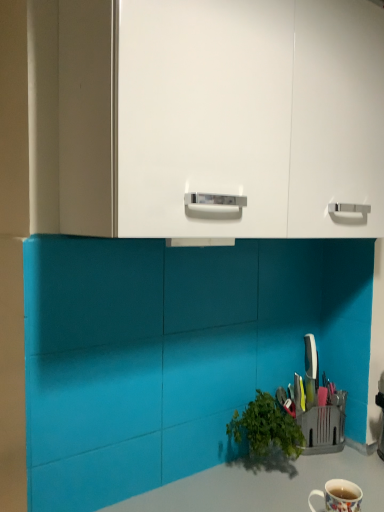
Find the location of `white glossy mug at lower right`. white glossy mug at lower right is located at coordinates tap(339, 496).

Identify the location of white glossy cabinet at upper center. (220, 114).

I want to click on white glossy mug at lower right, so click(339, 496).

Which is closer, [312,29] or [358,479]?

The point [312,29] is closer to the camera.

Looking at their sizes, would you say white glossy cabinet at upper center is wider or thinner than smooth gray countertop at lower center?

Considering their sizes, white glossy cabinet at upper center looks slimmer than smooth gray countertop at lower center.

How many degrees apart are the facing directions of white glossy cabinet at upper center and smooth gray countertop at lower center?

The facing directions of white glossy cabinet at upper center and smooth gray countertop at lower center are 1.27 degrees apart.

From the image's perspective, is white glossy cabinet at upper center positioned above or below smooth gray countertop at lower center?

Clearly, from the image's perspective, white glossy cabinet at upper center is above smooth gray countertop at lower center.

Between point (376, 468) and point (331, 499), which one is positioned in front?

Positioned in front is point (331, 499).

From a real-world perspective, between smooth gray countertop at lower center and white glossy mug at lower right, who is vertically higher?

From a 3D spatial view, white glossy mug at lower right is above.

Who is smaller, smooth gray countertop at lower center or white glossy mug at lower right?

With smaller size is white glossy mug at lower right.

The height and width of the screenshot is (512, 384). What are the coordinates of `coffee cup above the smooth gray countertop at lower center (from the image's perspective)` in the screenshot? It's located at (339, 496).

Is point (345, 485) closer or farther from the camera than point (300, 475)?

Point (345, 485) appears to be closer to the viewer than point (300, 475).

Does white glossy mug at lower right appear on the left side of smooth gray countertop at lower center?

In fact, white glossy mug at lower right is to the right of smooth gray countertop at lower center.

Considering the sizes of objects white glossy mug at lower right and smooth gray countertop at lower center in the image provided, who is wider, white glossy mug at lower right or smooth gray countertop at lower center?

Wider between the two is smooth gray countertop at lower center.

What's the angular difference between white glossy mug at lower right and smooth gray countertop at lower center's facing directions?

A: white glossy mug at lower right and smooth gray countertop at lower center are facing 7.22 degrees away from each other.

From the image's perspective, would you say white glossy cabinet at upper center is positioned over white glossy mug at lower right?

Yes, from the image's perspective, white glossy cabinet at upper center is above white glossy mug at lower right.

Is white glossy cabinet at upper center with white glossy mug at lower right?

No, white glossy cabinet at upper center is not next to white glossy mug at lower right.

Based on the photo, is white glossy mug at lower right a part of white glossy cabinet at upper center?

No.

Considering the relative sizes of white glossy mug at lower right and white glossy cabinet at upper center in the image provided, is white glossy mug at lower right thinner than white glossy cabinet at upper center?

Yes.

Is white glossy mug at lower right located outside white glossy cabinet at upper center?

→ That's correct, white glossy mug at lower right is outside of white glossy cabinet at upper center.

Is white glossy mug at lower right bigger than white glossy cabinet at upper center?

Actually, white glossy mug at lower right might be smaller than white glossy cabinet at upper center.

Is white glossy cabinet at upper center at the back of white glossy mug at lower right?

white glossy mug at lower right is not turned away from white glossy cabinet at upper center.

Considering the sizes of smooth gray countertop at lower center and white glossy cabinet at upper center in the image, is smooth gray countertop at lower center wider or thinner than white glossy cabinet at upper center?

Considering their sizes, smooth gray countertop at lower center looks broader than white glossy cabinet at upper center.

You are a GUI agent. You are given a task and a screenshot of the screen. Output one action in this format:
    pyautogui.click(x=<x>, y=<y>)
    Task: Click on the dresser on the left of smooth gray countertop at lower center
    This screenshot has width=384, height=512.
    Given the screenshot: What is the action you would take?
    pyautogui.click(x=220, y=114)

Where is `counter top located underneath the white glossy cabinet at upper center (from a real-world perspective)`? The image size is (384, 512). counter top located underneath the white glossy cabinet at upper center (from a real-world perspective) is located at coordinates (264, 485).

What are the coordinates of `coffee cup that appears above the smooth gray countertop at lower center (from a real-world perspective)` in the screenshot? It's located at (339, 496).

Considering their positions, is white glossy cabinet at upper center positioned closer to white glossy mug at lower right than smooth gray countertop at lower center?

smooth gray countertop at lower center is closer to white glossy mug at lower right.

Based on their spatial positions, is white glossy cabinet at upper center or white glossy mug at lower right further from smooth gray countertop at lower center?

Based on the image, white glossy cabinet at upper center appears to be further to smooth gray countertop at lower center.

When comparing their distances from white glossy cabinet at upper center, does smooth gray countertop at lower center or white glossy mug at lower right seem closer?

Based on the image, smooth gray countertop at lower center appears to be nearer to white glossy cabinet at upper center.

Estimate the real-world distances between objects in this image. Which object is further from white glossy cabinet at upper center, white glossy mug at lower right or smooth gray countertop at lower center?

white glossy mug at lower right.

Which object lies nearer to the anchor point smooth gray countertop at lower center, white glossy mug at lower right or white glossy cabinet at upper center?

Based on the image, white glossy mug at lower right appears to be nearer to smooth gray countertop at lower center.

Considering their positions, is smooth gray countertop at lower center positioned closer to white glossy mug at lower right than white glossy cabinet at upper center?

The object closer to white glossy mug at lower right is smooth gray countertop at lower center.

Identify the location of coffee cup between white glossy cabinet at upper center and smooth gray countertop at lower center from top to bottom. The width and height of the screenshot is (384, 512). click(339, 496).